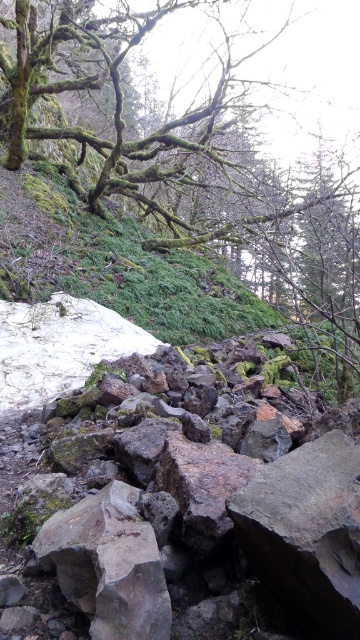
Does gray rough rocks at lower center appear over gray rough rock at center?

Yes, gray rough rocks at lower center is above gray rough rock at center.

Measure the distance between point (336, 499) and camera.

The distance of point (336, 499) from camera is 2.16 meters.

Is point (264, 397) farther from camera compared to point (123, 560)?

Yes, it is.

This screenshot has height=640, width=360. Identify the location of gray rough rocks at lower center. (186, 506).

Can you confirm if gray rough rocks at lower center is thinner than green mossy branch at upper left?

Yes.

Does gray rough rocks at lower center come behind green mossy branch at upper left?

No, it is in front of green mossy branch at upper left.

Between point (210, 589) and point (270, 253), which one is positioned behind?

The point (270, 253) is behind.

At what (x,y) coordinates should I click in order to perform the action: click on gray rough rocks at lower center. Please return your answer as a coordinate pair (x, y). This screenshot has height=640, width=360. Looking at the image, I should click on (186, 506).

Describe the element at coordinates (191, 161) in the screenshot. The image size is (360, 640). I see `green mossy branch at upper left` at that location.

Can you confirm if green mossy branch at upper left is positioned to the right of gray rough rock at center?

Indeed, green mossy branch at upper left is positioned on the right side of gray rough rock at center.

Measure the distance between green mossy branch at upper left and camera.

green mossy branch at upper left is 5.28 meters from camera.

The width and height of the screenshot is (360, 640). I want to click on green mossy branch at upper left, so click(191, 161).